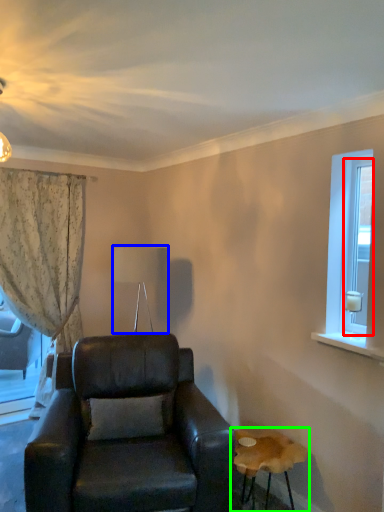
Question: Which object is positioned farthest from glass door (highlighted by a red box)? Select from lamp (highlighted by a blue box) and table (highlighted by a green box).

Choices:
 (A) lamp
 (B) table

Answer: (A)